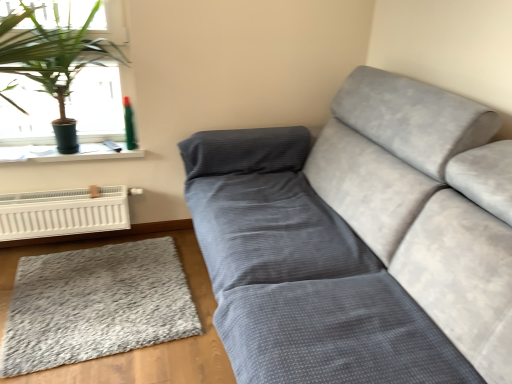
Question: Can you confirm if white plastic window sill at upper left is positioned to the right of velvet gray couch at center?

Choices:
 (A) no
 (B) yes

Answer: (A)

Question: Is white plastic window sill at upper left beside velvet gray couch at center?

Choices:
 (A) yes
 (B) no

Answer: (B)

Question: Could you tell me if white plastic window sill at upper left is facing velvet gray couch at center?

Choices:
 (A) no
 (B) yes

Answer: (A)

Question: Does white plastic window sill at upper left contain velvet gray couch at center?

Choices:
 (A) no
 (B) yes

Answer: (A)

Question: Considering the relative sizes of white plastic window sill at upper left and velvet gray couch at center in the image provided, is white plastic window sill at upper left smaller than velvet gray couch at center?

Choices:
 (A) no
 (B) yes

Answer: (B)

Question: Does white plastic window sill at upper left have a lesser width compared to velvet gray couch at center?

Choices:
 (A) yes
 (B) no

Answer: (A)

Question: Does white plastic heater at lower left appear on the right side of velvet gray couch at center?

Choices:
 (A) yes
 (B) no

Answer: (B)

Question: From the image's perspective, does white plastic heater at lower left appear lower than velvet gray couch at center?

Choices:
 (A) no
 (B) yes

Answer: (A)

Question: Is white plastic heater at lower left far from velvet gray couch at center?

Choices:
 (A) no
 (B) yes

Answer: (B)

Question: Does white plastic heater at lower left appear on the left side of velvet gray couch at center?

Choices:
 (A) yes
 (B) no

Answer: (A)

Question: Does white plastic heater at lower left turn towards velvet gray couch at center?

Choices:
 (A) no
 (B) yes

Answer: (A)

Question: Does white plastic heater at lower left have a lesser height compared to velvet gray couch at center?

Choices:
 (A) no
 (B) yes

Answer: (B)

Question: Can you confirm if teal plastic spray can at upper left is wider than green leafy plant at upper left?

Choices:
 (A) no
 (B) yes

Answer: (A)